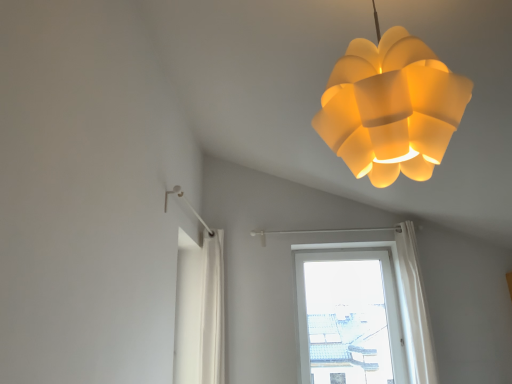
Locate an element on the screen. The image size is (512, 384). transparent glass window at center is located at coordinates (347, 322).

The height and width of the screenshot is (384, 512). What do you see at coordinates (347, 322) in the screenshot? I see `transparent glass window at center` at bounding box center [347, 322].

What do you see at coordinates (391, 108) in the screenshot?
I see `matte yellow plastic lamp at upper center` at bounding box center [391, 108].

Measure the distance between point (355, 94) and camera.

The depth of point (355, 94) is 1.11 meters.

Locate an element on the screen. Image resolution: width=512 pixels, height=384 pixels. matte yellow plastic lamp at upper center is located at coordinates (391, 108).

Where is `transparent glass window at center`? The image size is (512, 384). transparent glass window at center is located at coordinates (347, 322).

Is matte yellow plastic lamp at upper center to the right of transparent glass window at center from the viewer's perspective?

Incorrect, matte yellow plastic lamp at upper center is not on the right side of transparent glass window at center.

In the scene shown: Is matte yellow plastic lamp at upper center behind transparent glass window at center?

No, matte yellow plastic lamp at upper center is closer to the camera.

Considering the points (345, 85) and (360, 324), which point is in front, point (345, 85) or point (360, 324)?

The point (345, 85) is in front.

From the image's perspective, does matte yellow plastic lamp at upper center appear lower than transparent glass window at center?

Incorrect, from the image's perspective, matte yellow plastic lamp at upper center is higher than transparent glass window at center.

From a real-world perspective, is matte yellow plastic lamp at upper center on top of transparent glass window at center?

Yes, from a real-world perspective, matte yellow plastic lamp at upper center is above transparent glass window at center.

Between matte yellow plastic lamp at upper center and transparent glass window at center, which one has larger width?

matte yellow plastic lamp at upper center is wider.

Is matte yellow plastic lamp at upper center taller than transparent glass window at center?

In fact, matte yellow plastic lamp at upper center may be shorter than transparent glass window at center.

Based on the photo, between matte yellow plastic lamp at upper center and transparent glass window at center, which one has larger size?

matte yellow plastic lamp at upper center.

Is matte yellow plastic lamp at upper center inside or outside of transparent glass window at center?

matte yellow plastic lamp at upper center lies outside transparent glass window at center.

Are matte yellow plastic lamp at upper center and transparent glass window at center beside each other?

matte yellow plastic lamp at upper center and transparent glass window at center are not in contact.

In the scene shown: Is matte yellow plastic lamp at upper center looking in the opposite direction of transparent glass window at center?

No, transparent glass window at center is not at the back of matte yellow plastic lamp at upper center.

Can you tell me how much matte yellow plastic lamp at upper center and transparent glass window at center differ in facing direction?

81.6 degrees separate the facing orientations of matte yellow plastic lamp at upper center and transparent glass window at center.

How distant is matte yellow plastic lamp at upper center from transparent glass window at center?

A distance of 3.64 meters exists between matte yellow plastic lamp at upper center and transparent glass window at center.

At what (x,y) coordinates should I click in order to perform the action: click on window screen that is under the matte yellow plastic lamp at upper center (from a real-world perspective). Please return your answer as a coordinate pair (x, y). This screenshot has height=384, width=512. Looking at the image, I should click on (347, 322).

From the picture: Would you say transparent glass window at center is to the left or to the right of matte yellow plastic lamp at upper center in the picture?

From the image, it's evident that transparent glass window at center is to the right of matte yellow plastic lamp at upper center.

Relative to matte yellow plastic lamp at upper center, is transparent glass window at center in front or behind?

Visually, transparent glass window at center is located behind matte yellow plastic lamp at upper center.

Is point (351, 271) positioned behind point (376, 24)?

Yes.

From the image's perspective, does transparent glass window at center appear higher than matte yellow plastic lamp at upper center?

No, from the image's perspective, transparent glass window at center is not above matte yellow plastic lamp at upper center.

From a real-world perspective, which object stands above the other?

In real-world perspective, matte yellow plastic lamp at upper center is above.

In terms of width, does transparent glass window at center look wider or thinner when compared to matte yellow plastic lamp at upper center?

transparent glass window at center is thinner than matte yellow plastic lamp at upper center.

In terms of height, does transparent glass window at center look taller or shorter compared to matte yellow plastic lamp at upper center?

transparent glass window at center is taller than matte yellow plastic lamp at upper center.

Considering the sizes of objects transparent glass window at center and matte yellow plastic lamp at upper center in the image provided, who is smaller, transparent glass window at center or matte yellow plastic lamp at upper center?

Smaller between the two is transparent glass window at center.

Can we say transparent glass window at center lies outside matte yellow plastic lamp at upper center?

That's correct, transparent glass window at center is outside of matte yellow plastic lamp at upper center.

Are transparent glass window at center and matte yellow plastic lamp at upper center located far from each other?

Yes, transparent glass window at center and matte yellow plastic lamp at upper center are quite far apart.

Is transparent glass window at center aimed at matte yellow plastic lamp at upper center?

Yes, transparent glass window at center is aimed at matte yellow plastic lamp at upper center.

How distant is transparent glass window at center from matte yellow plastic lamp at upper center?

transparent glass window at center and matte yellow plastic lamp at upper center are 3.64 meters apart.

I want to click on lamp on the left of transparent glass window at center, so pyautogui.click(x=391, y=108).

At what (x,y) coordinates should I click in order to perform the action: click on window screen that appears below the matte yellow plastic lamp at upper center (from the image's perspective). Please return your answer as a coordinate pair (x, y). The width and height of the screenshot is (512, 384). Looking at the image, I should click on (347, 322).

Locate an element on the screen. The height and width of the screenshot is (384, 512). window screen that appears behind the matte yellow plastic lamp at upper center is located at coordinates (347, 322).